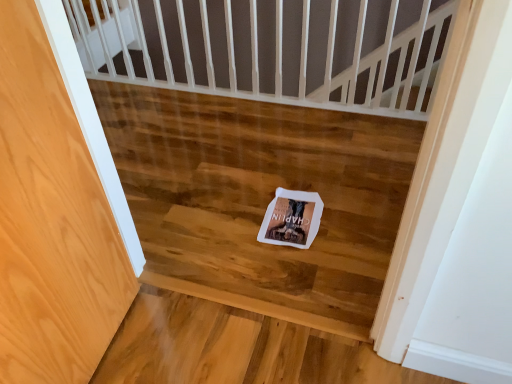
Locate an element on the screen. The image size is (512, 384). wooden floor at center is located at coordinates pos(260,199).

Describe the element at coordinates (260, 199) in the screenshot. I see `wooden floor at center` at that location.

In order to face wooden floor at center, should I rotate leftwards or rightwards?

You should rotate left by 7.793 degrees.

At what (x,y) coordinates should I click in order to perform the action: click on white paper postcard at center. Please return your answer as a coordinate pair (x, y). The height and width of the screenshot is (384, 512). Looking at the image, I should click on (292, 219).

What do you see at coordinates (292, 219) in the screenshot? Image resolution: width=512 pixels, height=384 pixels. I see `white paper postcard at center` at bounding box center [292, 219].

Identify the location of wooden floor at center. The image size is (512, 384). (260, 199).

Which object is positioned more to the right, wooden floor at center or white paper postcard at center?

white paper postcard at center is more to the right.

Relative to white paper postcard at center, is wooden floor at center in front or behind?

Visually, wooden floor at center is located in front of white paper postcard at center.

Which point is more forward, [181,113] or [293,218]?

Positioned in front is point [293,218].

From the image's perspective, which object appears higher, wooden floor at center or white paper postcard at center?

wooden floor at center is shown above in the image.

From a real-world perspective, between wooden floor at center and white paper postcard at center, who is vertically higher?

From a 3D spatial view, wooden floor at center is above.

Between wooden floor at center and white paper postcard at center, which one has smaller width?

white paper postcard at center is thinner.

Does wooden floor at center have a lesser height compared to white paper postcard at center?

Incorrect, the height of wooden floor at center does not fall short of that of white paper postcard at center.

Who is bigger, wooden floor at center or white paper postcard at center?

wooden floor at center.

Is wooden floor at center inside or outside of white paper postcard at center?

wooden floor at center lies outside white paper postcard at center.

Are wooden floor at center and white paper postcard at center making contact?

No, wooden floor at center is not beside white paper postcard at center.

Based on the photo, is wooden floor at center facing towards white paper postcard at center?

Yes, wooden floor at center is aimed at white paper postcard at center.

Locate an element on the screen. The height and width of the screenshot is (384, 512). stairwell above the white paper postcard at center (from the image's perspective) is located at coordinates (260, 199).

Is white paper postcard at center at the right side of wooden floor at center?

Yes, white paper postcard at center is to the right of wooden floor at center.

Which object is further away from the camera, white paper postcard at center or wooden floor at center?

white paper postcard at center.

Does point (301, 205) come behind point (257, 269)?

That is True.

From the image's perspective, would you say white paper postcard at center is shown under wooden floor at center?

Yes, from the image's perspective, white paper postcard at center is beneath wooden floor at center.

From a real-world perspective, is white paper postcard at center below wooden floor at center?

Indeed, from a real-world perspective, white paper postcard at center is positioned beneath wooden floor at center.

Considering the relative sizes of white paper postcard at center and wooden floor at center in the image provided, is white paper postcard at center wider than wooden floor at center?

No, white paper postcard at center is not wider than wooden floor at center.

In terms of height, does white paper postcard at center look taller or shorter compared to wooden floor at center?

white paper postcard at center is shorter than wooden floor at center.

In terms of size, does white paper postcard at center appear bigger or smaller than wooden floor at center?

In the image, white paper postcard at center appears to be smaller than wooden floor at center.

From the picture: Is wooden floor at center surrounded by white paper postcard at center?

Definitely not — wooden floor at center is not inside white paper postcard at center.

Is white paper postcard at center touching wooden floor at center?

They are not placed beside each other.

From the picture: Is white paper postcard at center positioned with its back to wooden floor at center?

Yes, white paper postcard at center is positioned with its back facing wooden floor at center.

Where is `stairwell above the white paper postcard at center (from the image's perspective)`? This screenshot has height=384, width=512. stairwell above the white paper postcard at center (from the image's perspective) is located at coordinates (260, 199).

Identify the location of stairwell on the left side of white paper postcard at center. This screenshot has height=384, width=512. (260, 199).

Find the location of a particular element. The width and height of the screenshot is (512, 384). stairwell located above the white paper postcard at center (from a real-world perspective) is located at coordinates (260, 199).